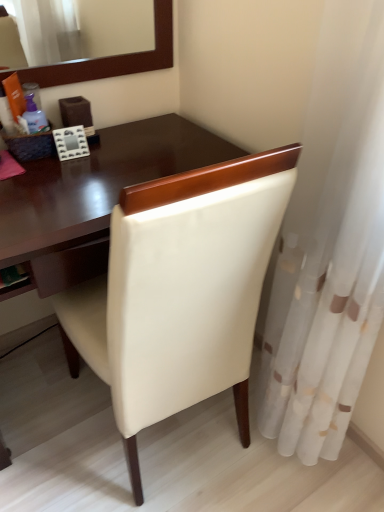
The height and width of the screenshot is (512, 384). What do you see at coordinates (180, 292) in the screenshot?
I see `white leather chair at center` at bounding box center [180, 292].

Identify the location of white leather chair at center. The width and height of the screenshot is (384, 512). (180, 292).

Locate an element on the screen. white leather chair at center is located at coordinates (180, 292).